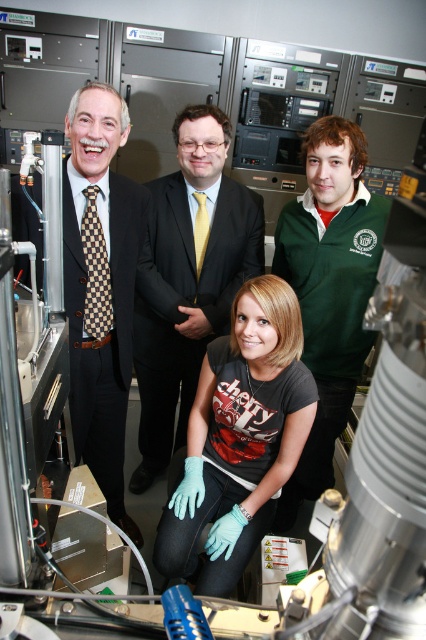
Between teal fabric gloves at lower center and matte black suit at left, which one has less height?

teal fabric gloves at lower center

At what (x,y) coordinates should I click in order to perform the action: click on teal fabric gloves at lower center. Please return your answer as a coordinate pair (x, y). Looking at the image, I should click on (239, 438).

Which is more to the left, matte black suit at left or green fleece jacket at upper right?

matte black suit at left is more to the left.

Where is `matte black suit at left`? The image size is (426, 640). matte black suit at left is located at coordinates (100, 285).

Which of these two, matte black suit at center or green fleece jacket at upper right, stands taller?

green fleece jacket at upper right is taller.

Is matte black suit at center above green fleece jacket at upper right?

Correct, matte black suit at center is located above green fleece jacket at upper right.

Is point (210, 132) positioned before point (353, 296)?

That is False.

This screenshot has height=640, width=426. I want to click on matte black suit at center, so click(187, 278).